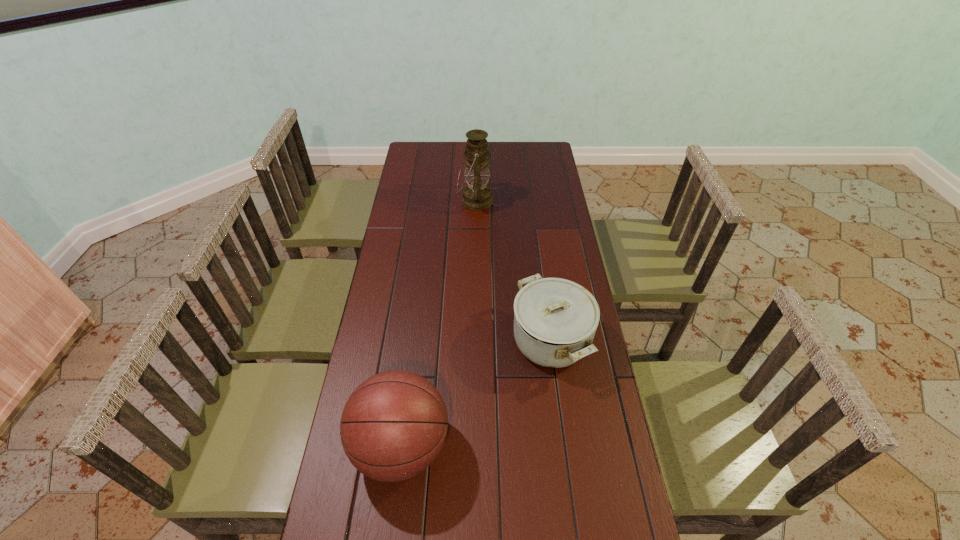
This screenshot has height=540, width=960. I want to click on object located at the right edge, so click(555, 320).

The height and width of the screenshot is (540, 960). In order to click on free spot at the far edge of the desktop in this screenshot , I will do click(x=494, y=146).

I want to click on free space at the left edge, so click(370, 315).

You are a GUI agent. You are given a task and a screenshot of the screen. Output one action in this format:
    pyautogui.click(x=<x>, y=<y>)
    Task: Click on the free space at the right edge
    This screenshot has height=540, width=960.
    Given the screenshot: What is the action you would take?
    pyautogui.click(x=612, y=428)

The height and width of the screenshot is (540, 960). Find the location of `vacant space at the far left corner`. vacant space at the far left corner is located at coordinates click(x=408, y=152).

Where is `vacant space at the far right corner`? This screenshot has height=540, width=960. vacant space at the far right corner is located at coordinates (540, 152).

At what (x,y) coordinates should I click in order to perform the action: click on free area in between the farthest object and the rightmost object. Please return your answer as a coordinate pair (x, y). Looking at the image, I should click on (513, 271).

Find the location of a particular element. This screenshot has width=960, height=540. vacant area that lies between the rightmost object and the farthest object is located at coordinates (513, 271).

Where is `free space between the basketball and the rightmost object`? The height and width of the screenshot is (540, 960). free space between the basketball and the rightmost object is located at coordinates (x=476, y=394).

Find the location of a particular element. This screenshot has height=540, width=960. vacant area that lies between the oil lamp and the saucepan is located at coordinates (513, 271).